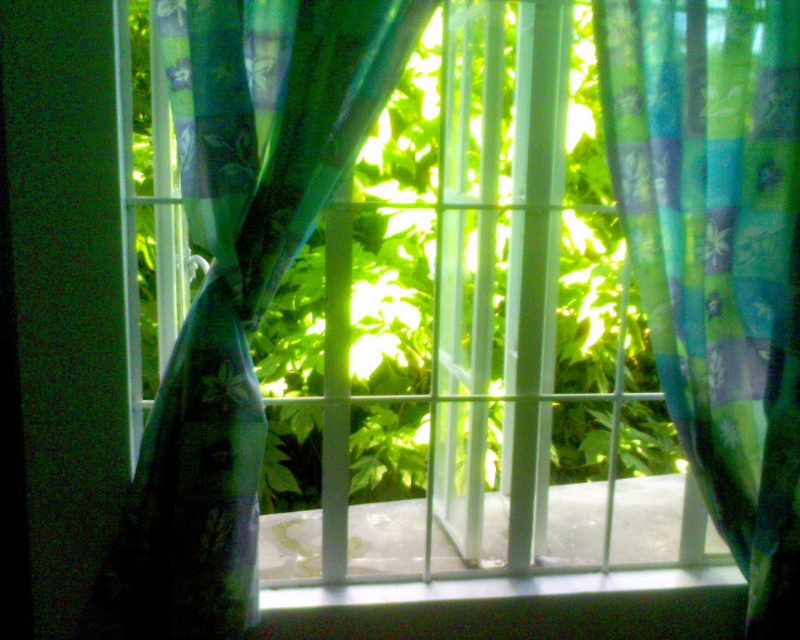
You are standing in a room with a window. You see a translucent floral fabric at center and a white smooth concrete at center. Which object is closer to you?

The translucent floral fabric at center is closer to you because it is in front of the white smooth concrete at center.